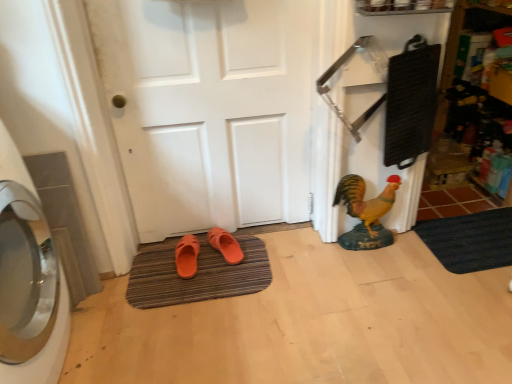
Describe the element at coordinates (29, 292) in the screenshot. The image size is (512, 384). I see `silver metallic washing machine at left` at that location.

What do you see at coordinates (197, 276) in the screenshot? Image resolution: width=512 pixels, height=384 pixels. I see `brown striped bath mat at center, the first bath mat viewed from the left` at bounding box center [197, 276].

Identify the location of orange rubber slipper at lower center, positioned as the first footwear in left-to-right order. This screenshot has height=384, width=512. (187, 256).

In order to click on orange matte slippers at center, arranged as the 2th footwear when viewed from the left in this screenshot , I will do `click(225, 245)`.

Find the location of a particular element. Image resolution: width=512 pixels, height=384 pixels. shiny yellow statue at right is located at coordinates (366, 201).

Measure the distance between point (x=252, y=67) and camera.

Point (x=252, y=67) is 5.46 feet from camera.

Where is `black rubber bath mat at lower right, marked as the second bath mat in a left-to-right arrangement`? This screenshot has height=384, width=512. black rubber bath mat at lower right, marked as the second bath mat in a left-to-right arrangement is located at coordinates (470, 240).

Can you see orange rubber slipper at lower center, positioned as the first footwear in left-to-right order, touching silver metallic washing machine at left?

No, orange rubber slipper at lower center, positioned as the first footwear in left-to-right order, is not making contact with silver metallic washing machine at left.

Between orange rubber slipper at lower center, positioned as the first footwear in left-to-right order, and silver metallic washing machine at left, which one has smaller width?

orange rubber slipper at lower center, positioned as the first footwear in left-to-right order.

Is orange rubber slipper at lower center, which is the second footwear from right to left, completely or partially outside of silver metallic washing machine at left?

Absolutely, orange rubber slipper at lower center, which is the second footwear from right to left, is external to silver metallic washing machine at left.

Is orange rubber slipper at lower center, positioned as the first footwear in left-to-right order, oriented away from silver metallic washing machine at left?

That's not correct — orange rubber slipper at lower center, positioned as the first footwear in left-to-right order, is not looking away from silver metallic washing machine at left.

From a real-world perspective, is shiny yellow statue at right physically located above or below orange rubber slipper at lower center, which is the second footwear from right to left?

From a real-world perspective, shiny yellow statue at right is physically above orange rubber slipper at lower center, which is the second footwear from right to left.

Does shiny yellow statue at right appear on the left side of orange rubber slipper at lower center, which is the second footwear from right to left?

In fact, shiny yellow statue at right is to the right of orange rubber slipper at lower center, which is the second footwear from right to left.

Considering the sizes of shiny yellow statue at right and orange rubber slipper at lower center, which is the second footwear from right to left, in the image, is shiny yellow statue at right bigger or smaller than orange rubber slipper at lower center, which is the second footwear from right to left,?

shiny yellow statue at right is bigger than orange rubber slipper at lower center, which is the second footwear from right to left.

Considering the sizes of objects orange matte slippers at center, arranged as the 2th footwear when viewed from the left, and brown striped bath mat at center, the first bath mat viewed from the left, in the image provided, who is taller, orange matte slippers at center, arranged as the 2th footwear when viewed from the left, or brown striped bath mat at center, the first bath mat viewed from the left,?

With more height is orange matte slippers at center, arranged as the 2th footwear when viewed from the left.

Is orange matte slippers at center, arranged as the 2th footwear when viewed from the left, behind brown striped bath mat at center, placed as the second bath mat when sorted from right to left?

Yes, orange matte slippers at center, arranged as the 2th footwear when viewed from the left, is further from the camera.

How distant is orange matte slippers at center, arranged as the 2th footwear when viewed from the left, from brown striped bath mat at center, placed as the second bath mat when sorted from right to left?

6.47 inches.

Based on the photo, would you say orange matte slippers at center, the 1th footwear viewed from the right, contains brown striped bath mat at center, the first bath mat viewed from the left?

No, brown striped bath mat at center, the first bath mat viewed from the left, is not surrounded by orange matte slippers at center, the 1th footwear viewed from the right.

From a real-world perspective, does black rubber bath mat at lower right, marked as the second bath mat in a left-to-right arrangement, sit lower than shiny yellow statue at right?

Correct, in the physical world, black rubber bath mat at lower right, marked as the second bath mat in a left-to-right arrangement, is lower than shiny yellow statue at right.

Which of these two, black rubber bath mat at lower right, which is counted as the 1th bath mat, starting from the right, or shiny yellow statue at right, is smaller?

black rubber bath mat at lower right, which is counted as the 1th bath mat, starting from the right.

Identify the location of chicken located above the black rubber bath mat at lower right, marked as the second bath mat in a left-to-right arrangement (from the image's perspective). (366, 201).

Considering the sizes of objects white matte door at center and orange matte slippers at center, arranged as the 2th footwear when viewed from the left, in the image provided, who is wider, white matte door at center or orange matte slippers at center, arranged as the 2th footwear when viewed from the left,?

With larger width is orange matte slippers at center, arranged as the 2th footwear when viewed from the left.

Is orange matte slippers at center, arranged as the 2th footwear when viewed from the left, at the back of white matte door at center?

No.

Choose the correct answer: Is white matte door at center inside orange matte slippers at center, the 1th footwear viewed from the right, or outside it?

white matte door at center exists outside the volume of orange matte slippers at center, the 1th footwear viewed from the right.

Consider the image. Is white matte door at center bigger or smaller than shiny yellow statue at right?

Considering their sizes, white matte door at center takes up more space than shiny yellow statue at right.

Consider the image. Is white matte door at center thinner than shiny yellow statue at right?

Yes, white matte door at center is thinner than shiny yellow statue at right.

Looking at this image, which is less distant, (220,27) or (354,176)?

Point (220,27) appears to be closer to the viewer than point (354,176).

Which of these two, white matte door at center or shiny yellow statue at right, stands taller?

With more height is white matte door at center.

Considering the positions of objects brown striped bath mat at center, placed as the second bath mat when sorted from right to left, and white matte door at center in the image provided, who is more to the left, brown striped bath mat at center, placed as the second bath mat when sorted from right to left, or white matte door at center?

From the viewer's perspective, brown striped bath mat at center, placed as the second bath mat when sorted from right to left, appears more on the left side.

From a real-world perspective, is brown striped bath mat at center, placed as the second bath mat when sorted from right to left, physically located above or below white matte door at center?

brown striped bath mat at center, placed as the second bath mat when sorted from right to left, is situated lower than white matte door at center in the real world.

Considering the sizes of objects brown striped bath mat at center, placed as the second bath mat when sorted from right to left, and white matte door at center in the image provided, who is taller, brown striped bath mat at center, placed as the second bath mat when sorted from right to left, or white matte door at center?

With more height is white matte door at center.

Which is in front, point (131, 295) or point (143, 43)?

The point (143, 43) is in front.

From a real-world perspective, count 1st footwears downward from the silver metallic washing machine at left and point to it. Please provide its 2D coordinates.

[(187, 256)]

Find the location of a particular element. The height and width of the screenshot is (384, 512). chicken that is above the orange rubber slipper at lower center, which is the second footwear from right to left (from a real-world perspective) is located at coordinates (366, 201).

Based on their spatial positions, is black rubber bath mat at lower right, which is counted as the 1th bath mat, starting from the right, or orange matte slippers at center, the 1th footwear viewed from the right, closer to orange rubber slipper at lower center, which is the second footwear from right to left?

orange matte slippers at center, the 1th footwear viewed from the right, lies closer to orange rubber slipper at lower center, which is the second footwear from right to left, than the other object.

Considering their positions, is silver metallic washing machine at left positioned closer to orange rubber slipper at lower center, which is the second footwear from right to left, than brown striped bath mat at center, the first bath mat viewed from the left?

Among the two, brown striped bath mat at center, the first bath mat viewed from the left, is located nearer to orange rubber slipper at lower center, which is the second footwear from right to left.

When comparing their distances from orange matte slippers at center, arranged as the 2th footwear when viewed from the left, does white matte door at center or silver metallic washing machine at left seem closer?

white matte door at center is closer to orange matte slippers at center, arranged as the 2th footwear when viewed from the left.

Looking at the image, which one is located further to black rubber bath mat at lower right, marked as the second bath mat in a left-to-right arrangement, white matte door at center or orange matte slippers at center, the 1th footwear viewed from the right?

white matte door at center is positioned further to the anchor black rubber bath mat at lower right, marked as the second bath mat in a left-to-right arrangement.

From the image, which object appears to be farther from orange matte slippers at center, the 1th footwear viewed from the right, white matte door at center or brown striped bath mat at center, the first bath mat viewed from the left?

white matte door at center is positioned further to the anchor orange matte slippers at center, the 1th footwear viewed from the right.

Estimate the real-world distances between objects in this image. Which object is further from black rubber bath mat at lower right, marked as the second bath mat in a left-to-right arrangement, orange rubber slipper at lower center, which is the second footwear from right to left, or brown striped bath mat at center, placed as the second bath mat when sorted from right to left?

orange rubber slipper at lower center, which is the second footwear from right to left.

When comparing their distances from orange rubber slipper at lower center, positioned as the first footwear in left-to-right order, does silver metallic washing machine at left or black rubber bath mat at lower right, marked as the second bath mat in a left-to-right arrangement, seem closer?

Based on the image, silver metallic washing machine at left appears to be nearer to orange rubber slipper at lower center, positioned as the first footwear in left-to-right order.

Which object lies nearer to the anchor point silver metallic washing machine at left, white matte door at center or orange rubber slipper at lower center, which is the second footwear from right to left?

The object closer to silver metallic washing machine at left is orange rubber slipper at lower center, which is the second footwear from right to left.

Locate an element on the screen. The height and width of the screenshot is (384, 512). chicken between orange rubber slipper at lower center, positioned as the first footwear in left-to-right order, and black rubber bath mat at lower right, marked as the second bath mat in a left-to-right arrangement is located at coordinates (366, 201).

The width and height of the screenshot is (512, 384). Find the location of `door located between brown striped bath mat at center, placed as the second bath mat when sorted from right to left, and black rubber bath mat at lower right, marked as the second bath mat in a left-to-right arrangement, in the left-right direction`. door located between brown striped bath mat at center, placed as the second bath mat when sorted from right to left, and black rubber bath mat at lower right, marked as the second bath mat in a left-to-right arrangement, in the left-right direction is located at coordinates pyautogui.click(x=209, y=109).

Identify the location of door between silver metallic washing machine at left and orange rubber slipper at lower center, which is the second footwear from right to left, along the z-axis. Image resolution: width=512 pixels, height=384 pixels. (209, 109).

The height and width of the screenshot is (384, 512). In order to click on footwear situated between white matte door at center and shiny yellow statue at right from left to right in this screenshot , I will do `click(225, 245)`.